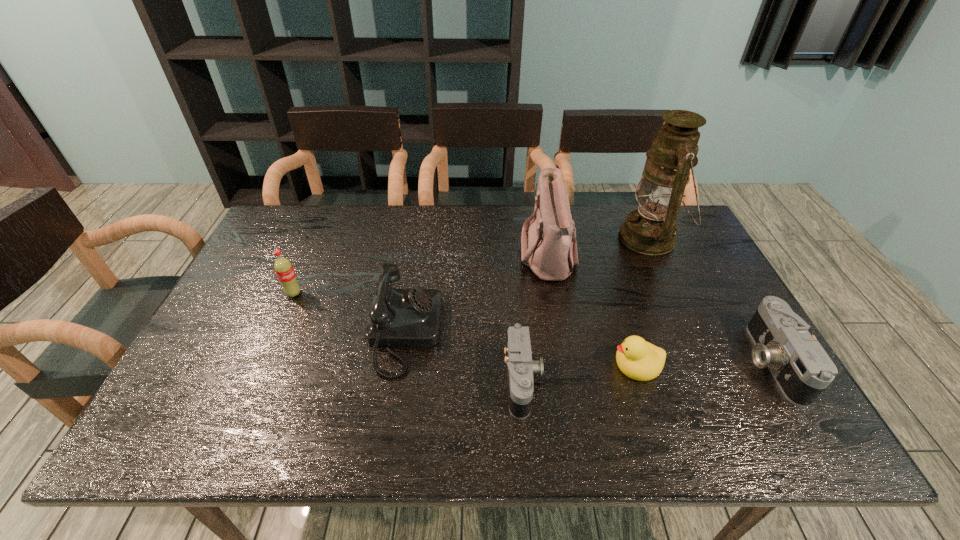
Please point a free position for a camera on the left. Please provide its 2D coordinates. Your answer should be formatted as a tuple, i.e. [(x, y)], where the tuple contains the x and y coordinates of a point satisfying the conditions above.

[(254, 401)]